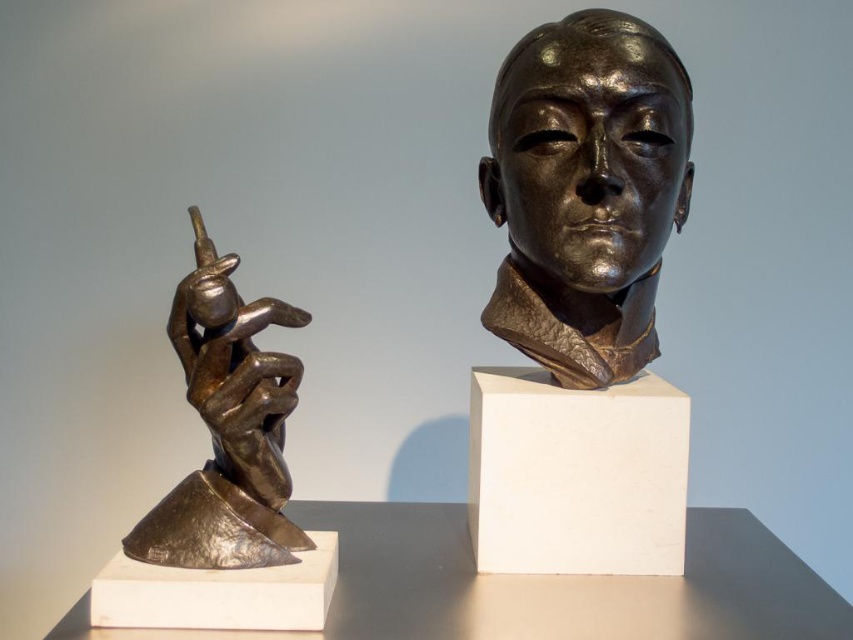
Question: Does bronze head at center lie in front of bronze textured hand at left?

Choices:
 (A) no
 (B) yes

Answer: (A)

Question: Which of the following is the farthest from the observer?

Choices:
 (A) (503, 72)
 (B) (519, 490)

Answer: (A)

Question: Among these points, which one is nearest to the camera?

Choices:
 (A) (231, 554)
 (B) (601, 136)
 (C) (561, 548)

Answer: (A)

Question: Does white matte pedestal at center have a smaller size compared to bronze textured hand at left?

Choices:
 (A) yes
 (B) no

Answer: (B)

Question: Does bronze head at center appear over white matte pedestal at center?

Choices:
 (A) no
 (B) yes

Answer: (B)

Question: Based on their relative distances, which object is nearer to the bronze textured hand at left?

Choices:
 (A) white matte pedestal at center
 (B) bronze head at center

Answer: (A)